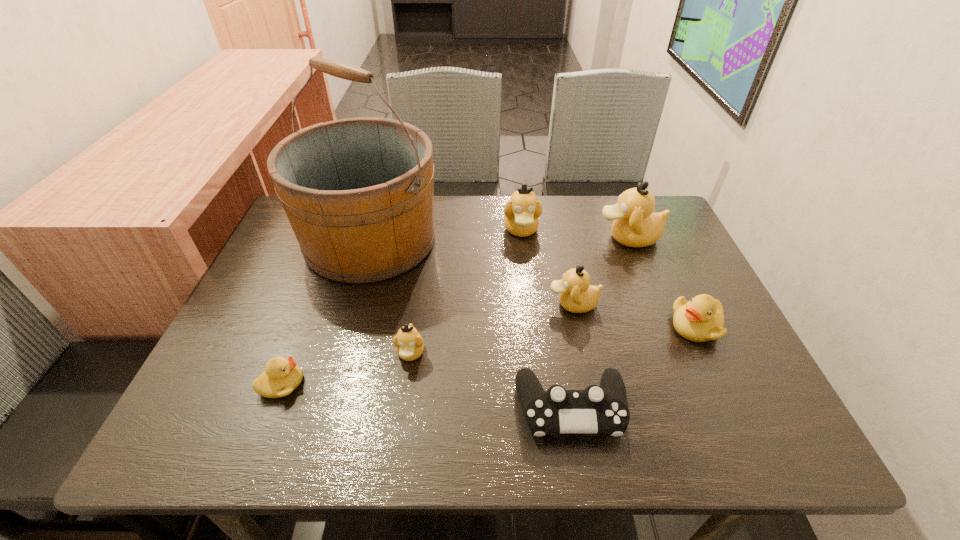
Where is `bucket`? bucket is located at coordinates (358, 192).

You are a GUI agent. You are given a task and a screenshot of the screen. Output one action in this format:
    pyautogui.click(x=<x>, y=<y>)
    Task: Click on the tallest duckling
    The height and width of the screenshot is (540, 960).
    Given the screenshot: What is the action you would take?
    click(635, 224)

You are a GUI agent. You are given a task and a screenshot of the screen. Output one action in this format:
    pyautogui.click(x=<x>, y=<y>)
    Task: Click on the second tallest object
    
    Given the screenshot: What is the action you would take?
    pyautogui.click(x=635, y=224)

Where is `the second tallest duckling`? Image resolution: width=960 pixels, height=540 pixels. the second tallest duckling is located at coordinates (521, 212).

This screenshot has width=960, height=540. What are the coordinates of `the sixth shortest object` in the screenshot? It's located at (521, 212).

At what (x,y) coordinates should I click in order to perform the action: click on the third biggest tan duckling. Please return your answer as a coordinate pair (x, y). This screenshot has width=960, height=540. Looking at the image, I should click on (577, 295).

Identify the location of the second nearest tan duckling. The height and width of the screenshot is (540, 960). (577, 295).

Locate an element on the screen. This screenshot has width=960, height=540. the right yellow duckling is located at coordinates (701, 319).

Image resolution: width=960 pixels, height=540 pixels. Identify the location of the bigger yellow duckling. (701, 319).

I want to click on the fifth duckling from right to left, so click(x=409, y=344).